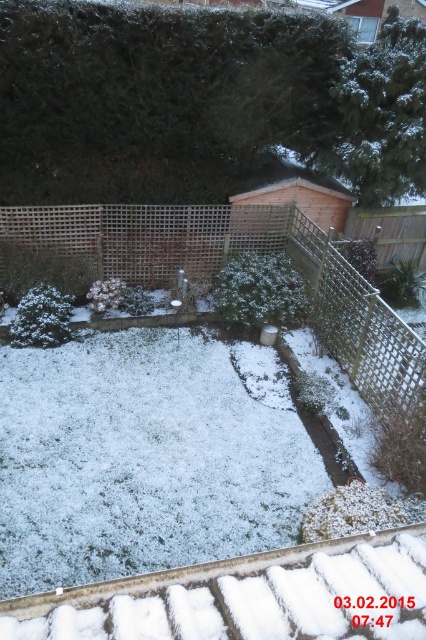
Question: Considering the relative positions of wooden lattice fence at center and wooden lattice fence at center-right in the image provided, where is wooden lattice fence at center located with respect to wooden lattice fence at center-right?

Choices:
 (A) left
 (B) right

Answer: (A)

Question: Can you confirm if wooden lattice fence at center is thinner than wooden lattice fence at center-right?

Choices:
 (A) no
 (B) yes

Answer: (A)

Question: Observing the image, what is the correct spatial positioning of wooden lattice fence at center in reference to wooden lattice fence at center-right?

Choices:
 (A) below
 (B) above

Answer: (B)